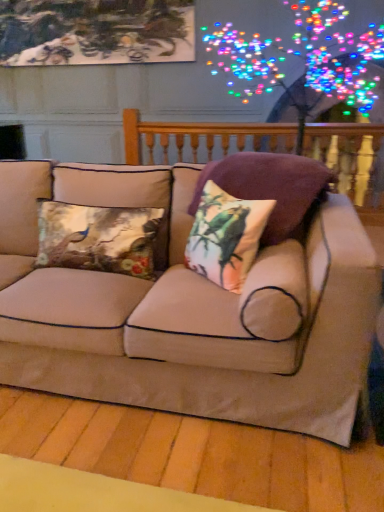
Question: Considering the positions of wooden balustrade at upper center and beige fabric couch at center in the image, is wooden balustrade at upper center wider or thinner than beige fabric couch at center?

Choices:
 (A) thin
 (B) wide

Answer: (A)

Question: Would you say wooden balustrade at upper center is inside or outside beige fabric couch at center?

Choices:
 (A) outside
 (B) inside

Answer: (A)

Question: Estimate the real-world distances between objects in this image. Which object is farther from the wooden balustrade at upper center?

Choices:
 (A) beige fabric couch at center
 (B) velvet floral pillow at center, placed as the third pillow when sorted from left to right
 (C) printed fabric cushion at center, acting as the second pillow starting from the left
 (D) metallic floral cushion at center left, acting as the third pillow starting from the right

Answer: (A)

Question: Which of these objects is positioned farthest from the beige fabric couch at center?

Choices:
 (A) velvet floral pillow at center, placed as the third pillow when sorted from left to right
 (B) metallic floral cushion at center left, acting as the first pillow starting from the left
 (C) printed fabric cushion at center, acting as the second pillow starting from the left
 (D) wooden balustrade at upper center

Answer: (D)